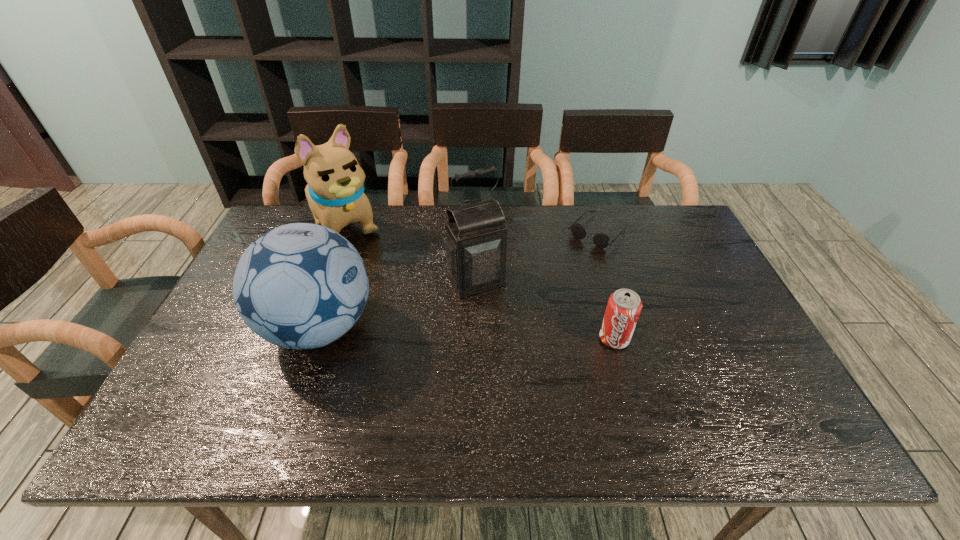
What are the coordinates of `vacant space on the desktop that is between the soccer ball and the second shortest object and is positioned on the face of the puppy` in the screenshot? It's located at (443, 332).

Where is `vacant space on the desktop that is between the soccer ball and the soda can and is positioned on the front-facing side of the shortest object`? vacant space on the desktop that is between the soccer ball and the soda can and is positioned on the front-facing side of the shortest object is located at coordinates (502, 334).

Where is `free space on the desktop that is between the soccer ball and the fourth tallest object and is positioned on the front-facing side of the lantern`? This screenshot has width=960, height=540. free space on the desktop that is between the soccer ball and the fourth tallest object and is positioned on the front-facing side of the lantern is located at coordinates (508, 335).